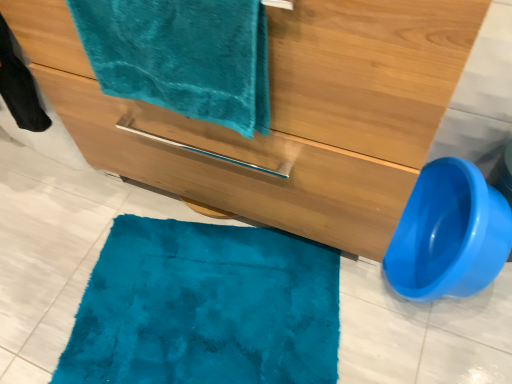
I want to click on blue plastic toilet bowl at lower right, so click(449, 234).

Measure the distance between point (175, 29) and camera.

The depth of point (175, 29) is 22.48 inches.

Identify the location of matte wood bathroom cabinet at center. point(285,114).

From a real-world perspective, is matte wood bathroom cabinet at center physically above blue plastic toilet bowl at lower right?

Yes, from a real-world perspective, matte wood bathroom cabinet at center is on top of blue plastic toilet bowl at lower right.

Does point (64, 40) come behind point (493, 189)?

No.

Does matte wood bathroom cabinet at center have a lesser width compared to blue plastic toilet bowl at lower right?

In fact, matte wood bathroom cabinet at center might be wider than blue plastic toilet bowl at lower right.

The width and height of the screenshot is (512, 384). I want to click on toilet bowl below the matte wood bathroom cabinet at center (from the image's perspective), so click(449, 234).

From the image's perspective, is blue plastic toilet bowl at lower right positioned above or below teal plush towel at upper left?

blue plastic toilet bowl at lower right is below teal plush towel at upper left.

Is blue plastic toilet bowl at lower right not near teal plush towel at upper left?

They are positioned close to each other.

Is teal plush towel at upper left oriented towards blue plastic toilet bowl at lower right?

No, teal plush towel at upper left does not turn towards blue plastic toilet bowl at lower right.

In terms of width, does teal plush towel at upper left look wider or thinner when compared to blue plastic toilet bowl at lower right?

Considering their sizes, teal plush towel at upper left looks slimmer than blue plastic toilet bowl at lower right.

Is teal plush towel at upper left taller or shorter than blue plastic toilet bowl at lower right?

In the image, teal plush towel at upper left appears to be shorter than blue plastic toilet bowl at lower right.

Considering the positions of point (260, 132) and point (443, 260), is point (260, 132) closer or farther from the camera than point (443, 260)?

Point (260, 132).

Is matte wood bathroom cabinet at center in front of or behind teal plush towel at upper left in the image?

matte wood bathroom cabinet at center is in front of teal plush towel at upper left.

Considering the relative sizes of matte wood bathroom cabinet at center and teal plush towel at upper left in the image provided, is matte wood bathroom cabinet at center shorter than teal plush towel at upper left?

No, matte wood bathroom cabinet at center is not shorter than teal plush towel at upper left.

Who is bigger, matte wood bathroom cabinet at center or teal plush towel at upper left?

Bigger between the two is matte wood bathroom cabinet at center.

Would you say teal plush towel at upper left is outside matte wood bathroom cabinet at center?

Yes, teal plush towel at upper left is outside of matte wood bathroom cabinet at center.

Image resolution: width=512 pixels, height=384 pixels. In order to click on bathroom cabinet located underneath the teal plush towel at upper left (from a real-world perspective) in this screenshot , I will do `click(285, 114)`.

From a real-world perspective, is teal plush towel at upper left positioned above or below matte wood bathroom cabinet at center?

Clearly, from a real-world perspective, teal plush towel at upper left is above matte wood bathroom cabinet at center.

From the image's perspective, relative to matte wood bathroom cabinet at center, is teal plush towel at upper left above or below?

From the image's perspective, teal plush towel at upper left appears below matte wood bathroom cabinet at center.

Who is bigger, blue plastic toilet bowl at lower right or matte wood bathroom cabinet at center?

Bigger between the two is matte wood bathroom cabinet at center.

Is blue plastic toilet bowl at lower right beside matte wood bathroom cabinet at center?

No, blue plastic toilet bowl at lower right is not in contact with matte wood bathroom cabinet at center.

What's the angular difference between blue plastic toilet bowl at lower right and matte wood bathroom cabinet at center's facing directions?

2.88 degrees.

The height and width of the screenshot is (384, 512). Find the location of `toilet bowl below the matte wood bathroom cabinet at center (from the image's perspective)`. toilet bowl below the matte wood bathroom cabinet at center (from the image's perspective) is located at coordinates (449, 234).

Find the location of a particular element. The height and width of the screenshot is (384, 512). bathroom cabinet in front of the blue plastic toilet bowl at lower right is located at coordinates [x=285, y=114].

Identify the location of towel located above the blue plastic toilet bowl at lower right (from a real-world perspective). (182, 56).

From the image, which object appears to be nearer to teal plush towel at upper left, matte wood bathroom cabinet at center or blue plastic toilet bowl at lower right?

The object closer to teal plush towel at upper left is matte wood bathroom cabinet at center.

When comparing their distances from teal plush towel at upper left, does blue plastic toilet bowl at lower right or matte wood bathroom cabinet at center seem closer?

matte wood bathroom cabinet at center lies closer to teal plush towel at upper left than the other object.

Based on their spatial positions, is blue plastic toilet bowl at lower right or teal plush towel at upper left closer to matte wood bathroom cabinet at center?

teal plush towel at upper left is closer to matte wood bathroom cabinet at center.

Considering their positions, is matte wood bathroom cabinet at center positioned closer to blue plastic toilet bowl at lower right than teal plush towel at upper left?

matte wood bathroom cabinet at center is positioned closer to the anchor blue plastic toilet bowl at lower right.

From the image, which object appears to be nearer to matte wood bathroom cabinet at center, teal plush towel at upper left or blue plastic toilet bowl at lower right?

teal plush towel at upper left lies closer to matte wood bathroom cabinet at center than the other object.

Considering their positions, is teal plush towel at upper left positioned closer to blue plastic toilet bowl at lower right than matte wood bathroom cabinet at center?

Based on the image, matte wood bathroom cabinet at center appears to be nearer to blue plastic toilet bowl at lower right.

Locate an element on the screen. This screenshot has height=384, width=512. bathroom cabinet situated between teal plush towel at upper left and blue plastic toilet bowl at lower right from left to right is located at coordinates (285, 114).